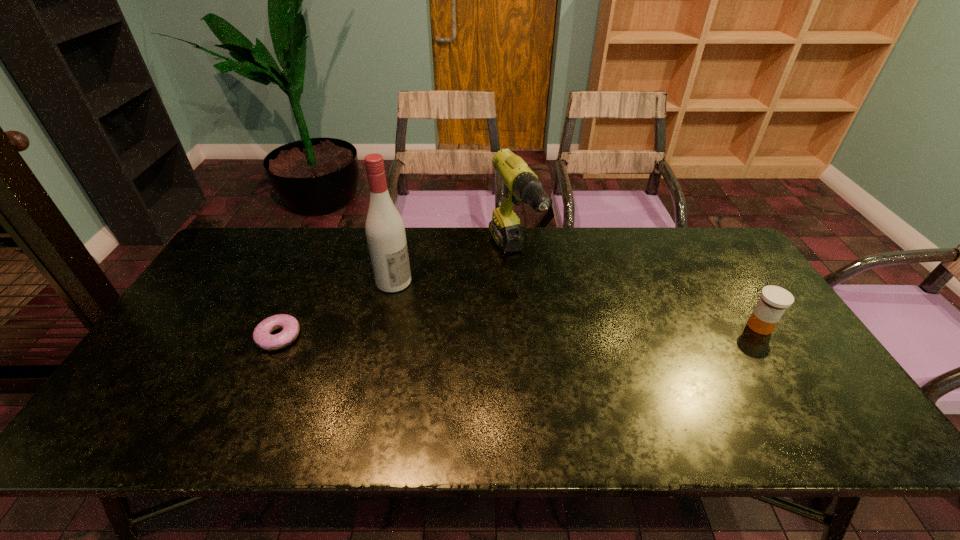
This screenshot has width=960, height=540. Identify the location of vacant space located on the label of the alcohol. pos(433,301).

This screenshot has height=540, width=960. Identify the location of free space located on the label of the alcohol. (478, 324).

Where is `blank space located 0.380m on the label of the alcohol`? The width and height of the screenshot is (960, 540). blank space located 0.380m on the label of the alcohol is located at coordinates pyautogui.click(x=516, y=343).

Find the location of a particular element. The width and height of the screenshot is (960, 540). vacant position located on the handle side of the third shortest object is located at coordinates (582, 380).

The width and height of the screenshot is (960, 540). In order to click on vacant space located on the handle side of the third shortest object in this screenshot , I will do `click(563, 349)`.

Find the location of a particular element. This screenshot has width=960, height=540. free space located 0.080m on the handle side of the third shortest object is located at coordinates (536, 306).

This screenshot has width=960, height=540. What are the coordinates of `alcohol situated at the far edge` in the screenshot? It's located at (385, 231).

This screenshot has width=960, height=540. In order to click on drill located in the far edge section of the desktop in this screenshot , I will do `click(521, 184)`.

What are the coordinates of `object located in the right edge section of the desktop` in the screenshot? It's located at (774, 300).

This screenshot has width=960, height=540. In the image, there is a desktop. What are the coordinates of `free space at the far edge` in the screenshot? It's located at (486, 259).